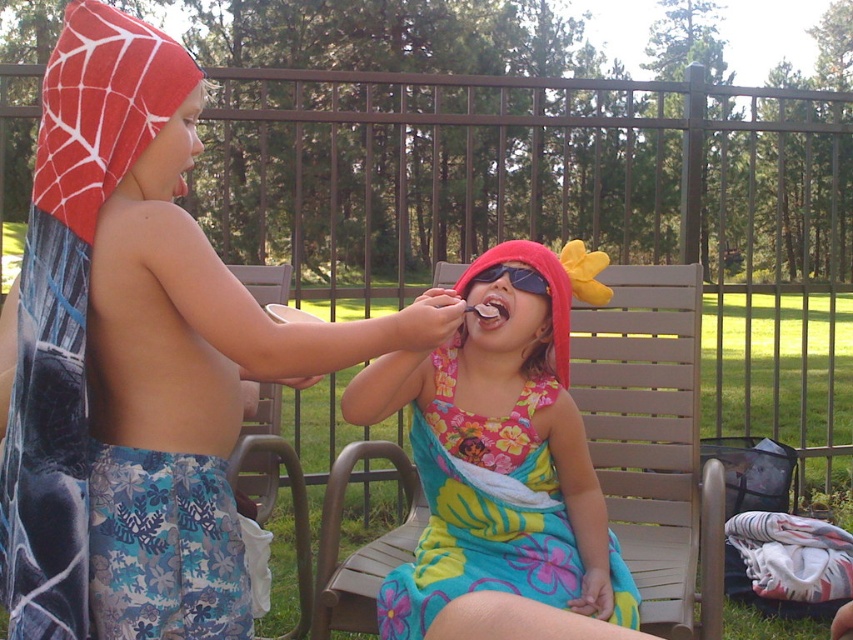
Question: Which object is the closest to the matte pink sunglasses at center?

Choices:
 (A) black plastic goggles at upper center
 (B) floral print fabric dress at center
 (C) spiderman towel at upper left

Answer: (A)

Question: Is spiderman towel at upper left to the left of black plastic goggles at upper center from the viewer's perspective?

Choices:
 (A) no
 (B) yes

Answer: (B)

Question: Among these points, which one is nearest to the camera?

Choices:
 (A) (178, 144)
 (B) (544, 292)
 (C) (453, 323)
 (D) (521, 280)

Answer: (A)

Question: Which of the following is the farthest from the observer?

Choices:
 (A) floral fabric dress at center
 (B) floral print fabric dress at center
 (C) spiderman towel at upper left
 (D) black plastic goggles at upper center

Answer: (D)

Question: Is spiderman towel at upper left to the left of matte pink sunglasses at center from the viewer's perspective?

Choices:
 (A) yes
 (B) no

Answer: (A)

Question: Does floral print fabric dress at center have a greater width compared to black plastic goggles at upper center?

Choices:
 (A) no
 (B) yes

Answer: (B)